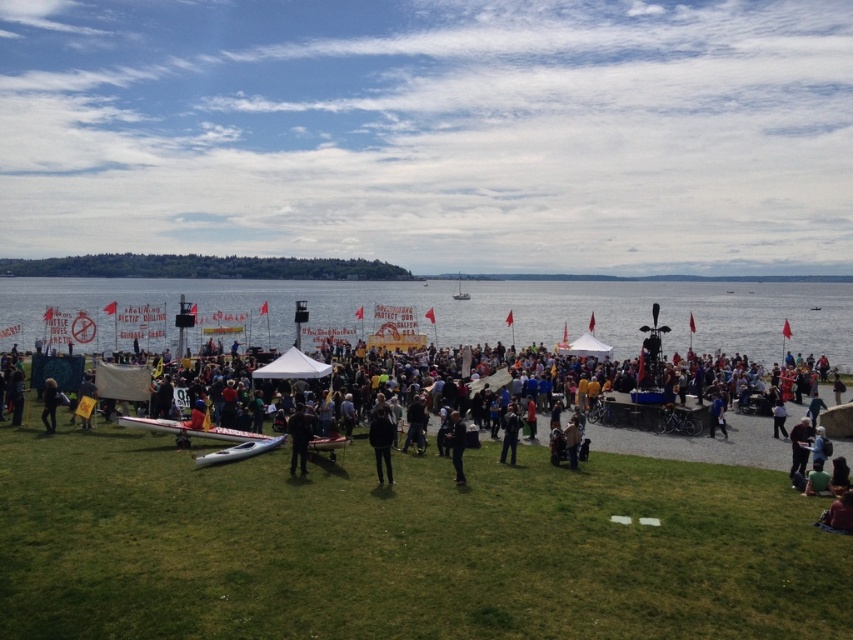
Question: Can you confirm if black fabric person at center is positioned to the left of dark gray fabric jacket at center?

Choices:
 (A) yes
 (B) no

Answer: (A)

Question: Which point appears farthest from the camera in this image?

Choices:
 (A) (804, 458)
 (B) (374, 452)
 (C) (291, 468)

Answer: (A)

Question: Which point is closer to the camera taking this photo?

Choices:
 (A) (x=791, y=458)
 (B) (x=300, y=444)
 (C) (x=503, y=445)

Answer: (B)

Question: Considering the relative positions of dark blue jeans at lower right and dark gray pants at center in the image provided, where is dark blue jeans at lower right located with respect to dark gray pants at center?

Choices:
 (A) above
 (B) below

Answer: (B)

Question: Which object appears closest to the camera in this image?

Choices:
 (A) clear blue water at center
 (B) dark gray pants at center
 (C) dark blue jeans at lower right

Answer: (B)

Question: Observing the image, what is the correct spatial positioning of green grass at lower left in reference to dark gray pants at center?

Choices:
 (A) below
 (B) above

Answer: (A)